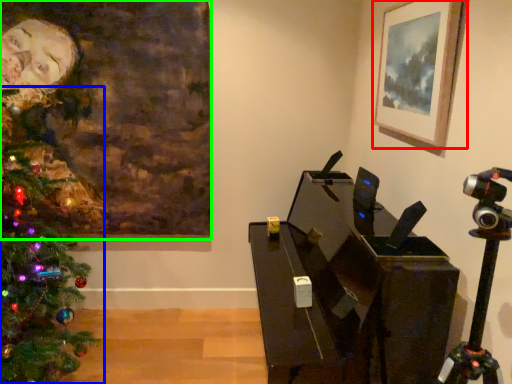
Question: Which is nearer to the picture frame (highlighted by a red box)? christmas tree (highlighted by a blue box) or picture frame (highlighted by a green box).

Choices:
 (A) christmas tree
 (B) picture frame

Answer: (B)